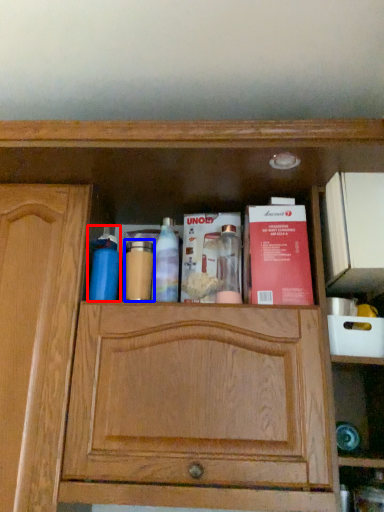
Question: Which of the following is the closest to the observer, cleaning product (highlighted by a red box) or toiletry (highlighted by a blue box)?

Choices:
 (A) cleaning product
 (B) toiletry

Answer: (A)